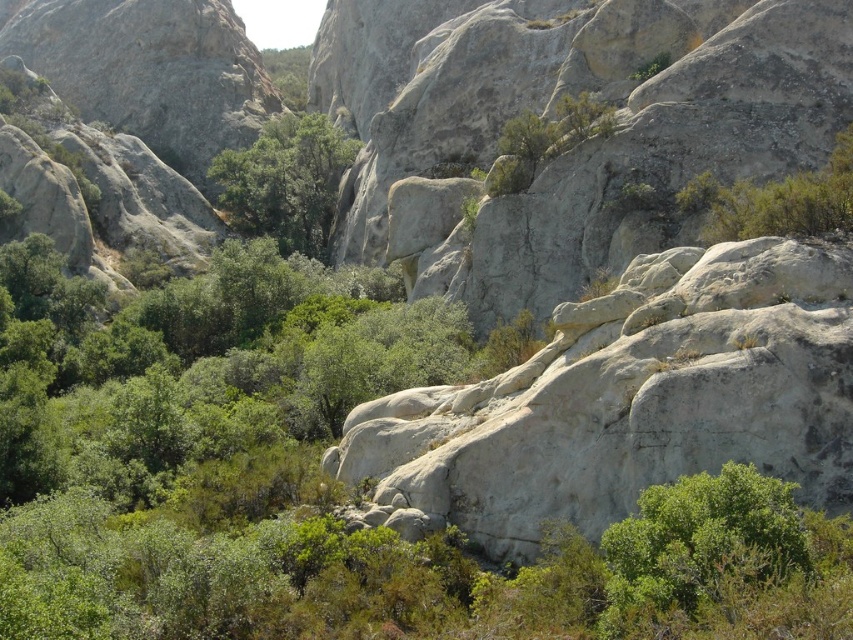
Is green leafy tree at center taller than green leafy shrub at upper right?

Yes.

Looking at this image, is green leafy tree at center to the right of green leafy shrub at upper right from the viewer's perspective?

In fact, green leafy tree at center is to the left of green leafy shrub at upper right.

Who is more distant from viewer, [334,198] or [682,205]?

Positioned behind is point [334,198].

This screenshot has width=853, height=640. Identify the location of green leafy tree at center. (285, 180).